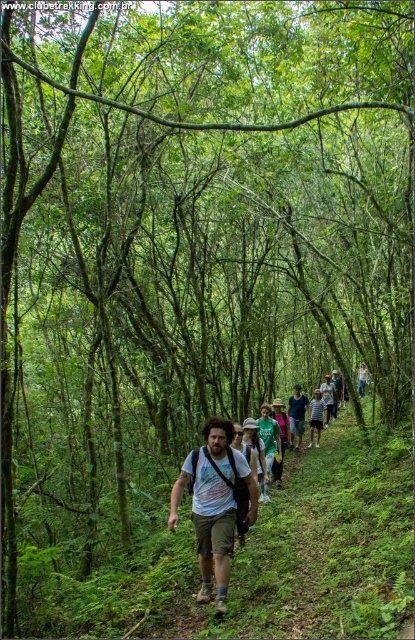
Question: From the image, what is the correct spatial relationship of light brown cotton shorts at center in relation to light blue cotton shirt at center?

Choices:
 (A) above
 (B) below

Answer: (A)

Question: Which object is closer to the camera taking this photo?

Choices:
 (A) light blue cotton shirt at center
 (B) light brown cotton shorts at center

Answer: (B)

Question: Does light brown cotton shorts at center appear on the right side of light blue cotton shirt at center?

Choices:
 (A) yes
 (B) no

Answer: (B)

Question: Which point appears closest to the camera in this image?

Choices:
 (A) (219, 435)
 (B) (317, 410)

Answer: (A)

Question: Can you confirm if light brown cotton shorts at center is wider than light blue cotton shirt at center?

Choices:
 (A) yes
 (B) no

Answer: (A)